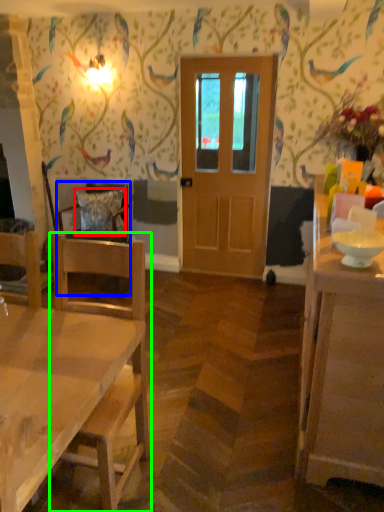
Question: Which is farther away from pillow (highlighted by a red box)? chair (highlighted by a blue box) or chair (highlighted by a green box)?

Choices:
 (A) chair
 (B) chair

Answer: (B)